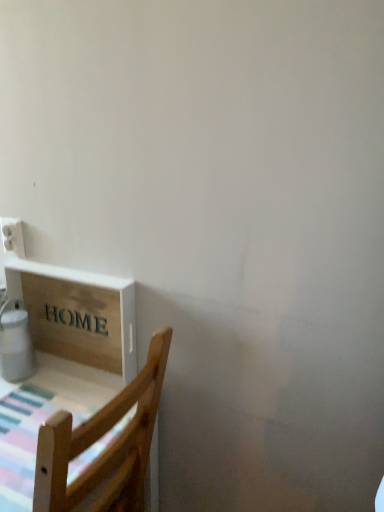
You are a GUI agent. You are given a task and a screenshot of the screen. Output one action in this format:
    pyautogui.click(x=<x>, y=<y>)
    Task: Click on the white plastic electric outlet at upper left
    The height and width of the screenshot is (512, 384).
    Given the screenshot: What is the action you would take?
    pyautogui.click(x=12, y=236)

Locate an element on the screen. wooden chair at lower left is located at coordinates (105, 448).

Measure the distance between wooden sign at lower left and camera.

A distance of 3.53 feet exists between wooden sign at lower left and camera.

Locate an element on the screen. The height and width of the screenshot is (512, 384). white plastic electric outlet at upper left is located at coordinates (12, 236).

Is wooden sign at lower left oriented away from white glossy water heater at lower left?

No, white glossy water heater at lower left is not at the back of wooden sign at lower left.

Considering the points (130, 287) and (26, 331), which point is behind, point (130, 287) or point (26, 331)?

The point (26, 331) is behind.

Could white glossy water heater at lower left be considered to be inside wooden sign at lower left?

Actually, white glossy water heater at lower left is outside wooden sign at lower left.

Is wooden sign at lower left in contact with white glossy water heater at lower left?

No, wooden sign at lower left is not making contact with white glossy water heater at lower left.

Does point (115, 493) lie behind point (3, 238)?

No, (115, 493) is closer to viewer.

Is the depth of wooden chair at lower left greater than that of white plastic electric outlet at upper left?

No, wooden chair at lower left is closer to the viewer.

Does wooden chair at lower left have a greater width compared to white plastic electric outlet at upper left?

Yes, wooden chair at lower left is wider than white plastic electric outlet at upper left.

From the image's perspective, is wooden chair at lower left below white plastic electric outlet at upper left?

Indeed, from the image's perspective, wooden chair at lower left is shown beneath white plastic electric outlet at upper left.

How different are the orientations of white plastic electric outlet at upper left and wooden sign at lower left in degrees?

0.00318 degrees separate the facing orientations of white plastic electric outlet at upper left and wooden sign at lower left.

Which object is positioned more to the right, white plastic electric outlet at upper left or wooden sign at lower left?

From the viewer's perspective, wooden sign at lower left appears more on the right side.

Looking at the image, does white plastic electric outlet at upper left seem bigger or smaller compared to wooden sign at lower left?

white plastic electric outlet at upper left is smaller than wooden sign at lower left.

In terms of width, does white plastic electric outlet at upper left look wider or thinner when compared to wooden sign at lower left?

Clearly, white plastic electric outlet at upper left has less width compared to wooden sign at lower left.

Considering the sizes of objects wooden chair at lower left and wooden sign at lower left in the image provided, who is taller, wooden chair at lower left or wooden sign at lower left?

Standing taller between the two is wooden chair at lower left.

Is wooden chair at lower left wider or thinner than wooden sign at lower left?

wooden chair at lower left is wider than wooden sign at lower left.

From a real-world perspective, between wooden chair at lower left and wooden sign at lower left, who is vertically higher?

wooden sign at lower left, from a real-world perspective.

Considering the relative sizes of wooden chair at lower left and white glossy water heater at lower left in the image provided, is wooden chair at lower left shorter than white glossy water heater at lower left?

No, wooden chair at lower left is not shorter than white glossy water heater at lower left.

Between wooden chair at lower left and white glossy water heater at lower left, which one has smaller width?

white glossy water heater at lower left.

Does point (41, 472) come behind point (6, 329)?

That is False.

From a real-world perspective, which is physically below, wooden chair at lower left or white glossy water heater at lower left?

In real-world perspective, wooden chair at lower left is lower.

Is wooden sign at lower left oriented towards wooden chair at lower left?

No, wooden sign at lower left is not facing towards wooden chair at lower left.

Considering the sizes of wooden sign at lower left and wooden chair at lower left in the image, is wooden sign at lower left bigger or smaller than wooden chair at lower left?

Considering their sizes, wooden sign at lower left takes up less space than wooden chair at lower left.

Which is more to the left, wooden sign at lower left or wooden chair at lower left?

wooden chair at lower left.

Measure the distance between wooden sign at lower left and wooden chair at lower left.

They are 34.15 centimeters apart.

Who is smaller, white glossy water heater at lower left or wooden sign at lower left?

With smaller size is white glossy water heater at lower left.

Which is in front, point (23, 365) or point (69, 354)?

The point (23, 365) is in front.

Is white glossy water heater at lower left far away from wooden sign at lower left?

No, there isn't a large distance between white glossy water heater at lower left and wooden sign at lower left.

What are the coordinates of `water heater on the left of wooden sign at lower left` in the screenshot? It's located at (15, 343).

Identify the location of cardboard box that is above the white glossy water heater at lower left (from the image's perspective). (81, 317).

This screenshot has height=512, width=384. I want to click on furniture that appears in front of the white plastic electric outlet at upper left, so click(105, 448).

When comparing their distances from white plastic electric outlet at upper left, does wooden sign at lower left or white glossy water heater at lower left seem closer?

white glossy water heater at lower left.

Looking at the image, which one is located closer to wooden sign at lower left, wooden chair at lower left or white plastic electric outlet at upper left?

white plastic electric outlet at upper left is closer to wooden sign at lower left.

Estimate the real-world distances between objects in this image. Which object is further from white glossy water heater at lower left, wooden sign at lower left or white plastic electric outlet at upper left?

white plastic electric outlet at upper left is further to white glossy water heater at lower left.

Which object lies further to the anchor point wooden chair at lower left, white plastic electric outlet at upper left or wooden sign at lower left?

white plastic electric outlet at upper left lies further to wooden chair at lower left than the other object.

Based on their spatial positions, is wooden sign at lower left or wooden chair at lower left further from white glossy water heater at lower left?

Based on the image, wooden chair at lower left appears to be further to white glossy water heater at lower left.

Looking at this image, based on their spatial positions, is wooden chair at lower left or wooden sign at lower left closer to white glossy water heater at lower left?

wooden sign at lower left lies closer to white glossy water heater at lower left than the other object.

Based on their spatial positions, is white plastic electric outlet at upper left or white glossy water heater at lower left further from wooden sign at lower left?

Among the two, white plastic electric outlet at upper left is located further to wooden sign at lower left.

Based on their spatial positions, is white plastic electric outlet at upper left or wooden sign at lower left closer to white glossy water heater at lower left?

wooden sign at lower left.

The image size is (384, 512). In order to click on water heater between wooden sign at lower left and wooden chair at lower left in the up-down direction in this screenshot , I will do `click(15, 343)`.

This screenshot has height=512, width=384. Identify the location of cardboard box between white plastic electric outlet at upper left and wooden chair at lower left vertically. (81, 317).

The image size is (384, 512). What are the coordinates of `water heater between white plastic electric outlet at upper left and wooden chair at lower left vertically` in the screenshot? It's located at (15, 343).

The image size is (384, 512). I want to click on cardboard box between white plastic electric outlet at upper left and white glossy water heater at lower left vertically, so click(81, 317).